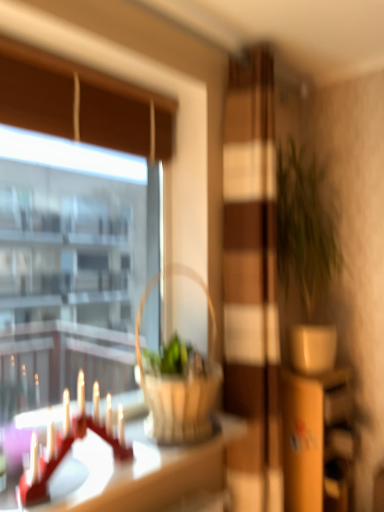
Locate an element on the screen. This screenshot has width=384, height=512. free space above wooden screen door at center (from a real-world perspective) is located at coordinates (249, 38).